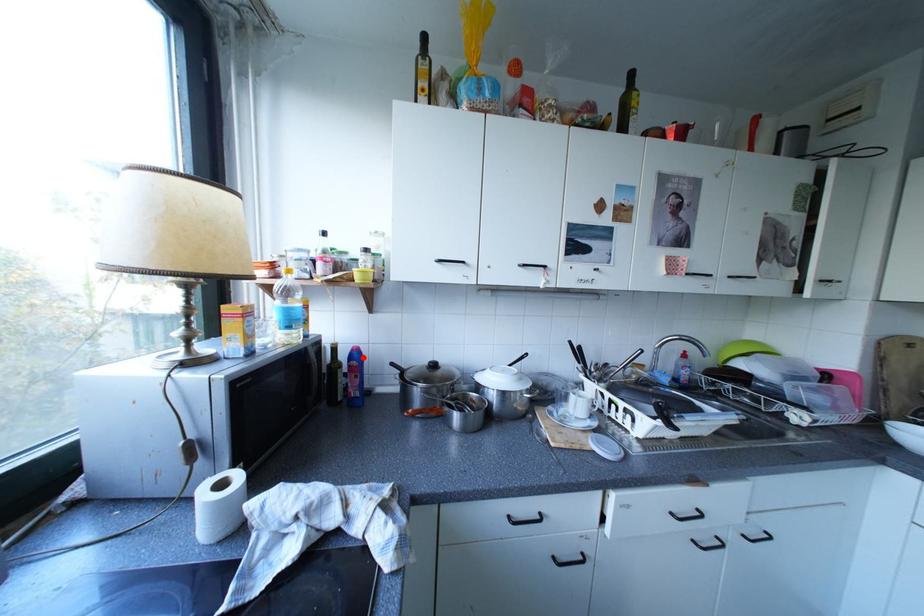
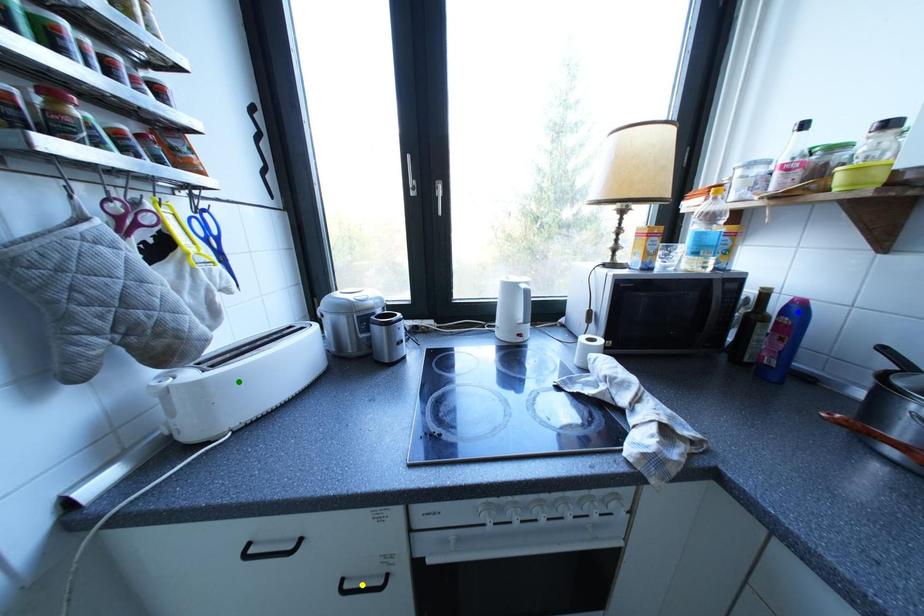
Question: I am providing you with two images of the same scene from different viewpoints. A red point is marked on the first image. You are given multiple points on the second image. In image 2, which mark is for the same physical point as the one in image 1?

Choices:
 (A) blue point
 (B) yellow point
 (C) green point

Answer: (A)